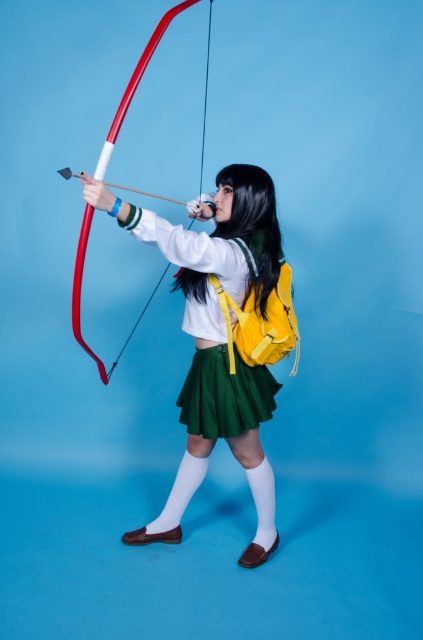
Consider the image. Is matte white sweater at center smaller than shiny red bow at center?

No.

Is matte white sweater at center below shiny red bow at center?

Indeed, matte white sweater at center is positioned under shiny red bow at center.

Does point (153, 220) lie in front of point (104, 368)?

That is True.

I want to click on matte white sweater at center, so click(222, 337).